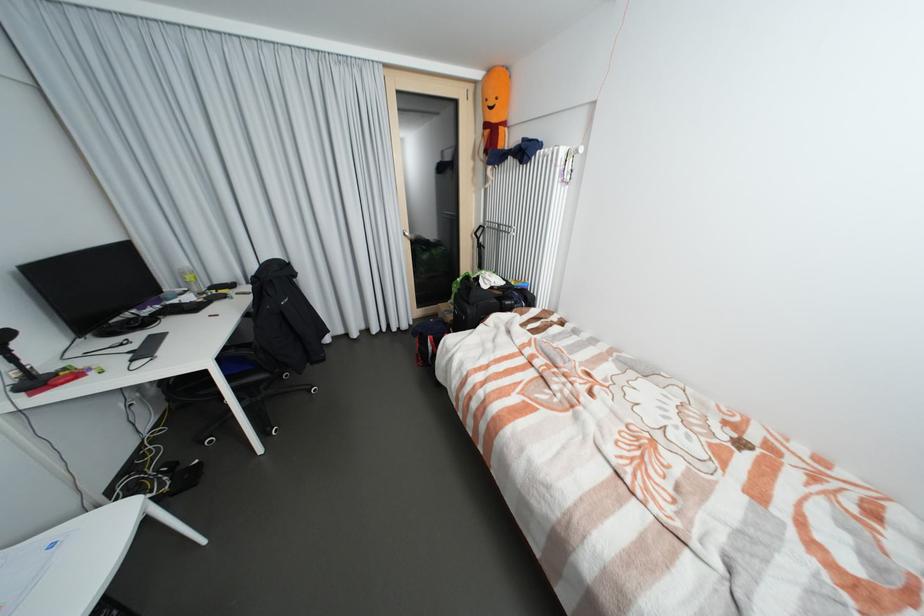
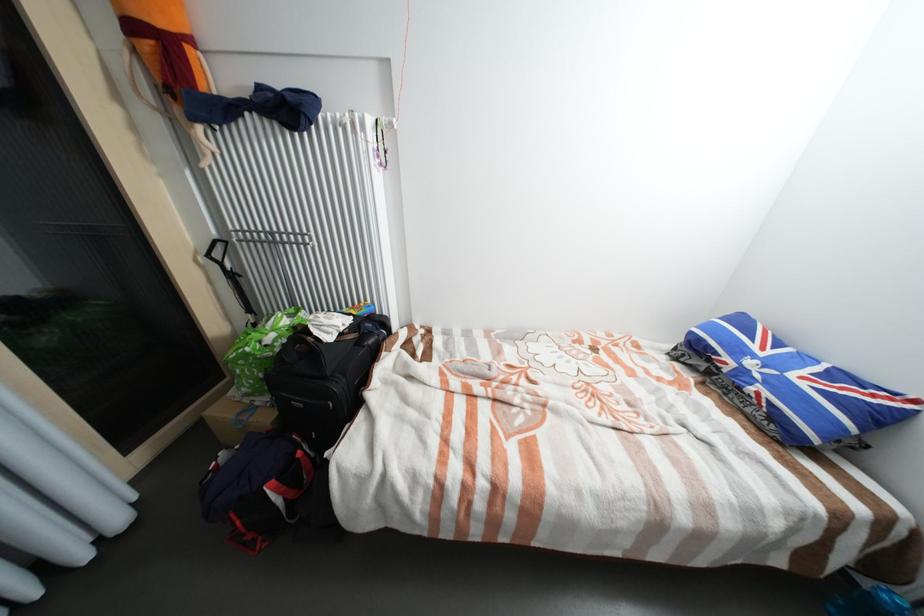
Where in the second image is the point corresponding to point (457, 318) from the first image?

(273, 419)